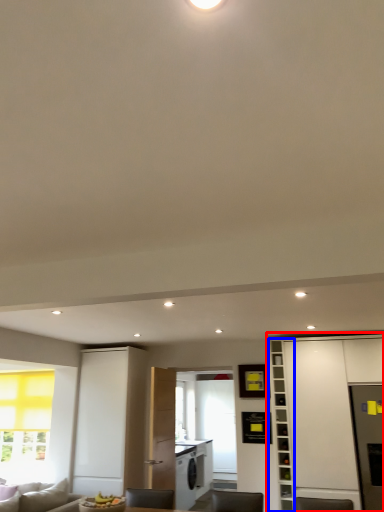
Question: Which object appears farthest to the camera in this image, cabinetry (highlighted by a red box) or bookshelf (highlighted by a blue box)?

Choices:
 (A) cabinetry
 (B) bookshelf

Answer: (B)